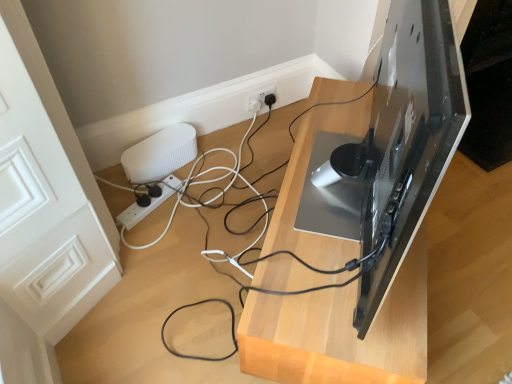
Question: From a real-world perspective, is white plastic power strip at lower center located beneath glossy black monitor at upper right?

Choices:
 (A) no
 (B) yes

Answer: (B)

Question: Is white plastic power strip at lower center facing away from glossy black monitor at upper right?

Choices:
 (A) no
 (B) yes

Answer: (A)

Question: Does white plastic power strip at lower center come behind glossy black monitor at upper right?

Choices:
 (A) no
 (B) yes

Answer: (B)

Question: Does white plastic power strip at lower center have a larger size compared to glossy black monitor at upper right?

Choices:
 (A) yes
 (B) no

Answer: (B)

Question: Can you confirm if white plastic power strip at lower center is wider than glossy black monitor at upper right?

Choices:
 (A) yes
 (B) no

Answer: (B)

Question: In the image, is white ribbed speaker at lower left positioned in front of or behind glossy black monitor at upper right?

Choices:
 (A) front
 (B) behind

Answer: (B)

Question: Based on their positions, is white ribbed speaker at lower left located to the left or right of glossy black monitor at upper right?

Choices:
 (A) left
 (B) right

Answer: (A)

Question: From their relative heights in the image, would you say white ribbed speaker at lower left is taller or shorter than glossy black monitor at upper right?

Choices:
 (A) short
 (B) tall

Answer: (A)

Question: Is point (182, 162) closer or farther from the camera than point (378, 94)?

Choices:
 (A) closer
 (B) farther

Answer: (B)

Question: Is white plastic power strip at lower center in front of or behind white ribbed speaker at lower left in the image?

Choices:
 (A) front
 (B) behind

Answer: (A)

Question: Do you think white plastic power strip at lower center is within white ribbed speaker at lower left, or outside of it?

Choices:
 (A) inside
 (B) outside

Answer: (B)

Question: From the image's perspective, is white plastic power strip at lower center positioned above or below white ribbed speaker at lower left?

Choices:
 (A) below
 (B) above

Answer: (A)

Question: In terms of height, does white plastic power strip at lower center look taller or shorter compared to white ribbed speaker at lower left?

Choices:
 (A) short
 (B) tall

Answer: (A)

Question: Choose the correct answer: Is white ribbed speaker at lower left inside black glossy tv stand at upper right or outside it?

Choices:
 (A) inside
 (B) outside

Answer: (B)

Question: Considering the relative positions of white ribbed speaker at lower left and black glossy tv stand at upper right in the image provided, is white ribbed speaker at lower left to the left or to the right of black glossy tv stand at upper right?

Choices:
 (A) right
 (B) left

Answer: (B)